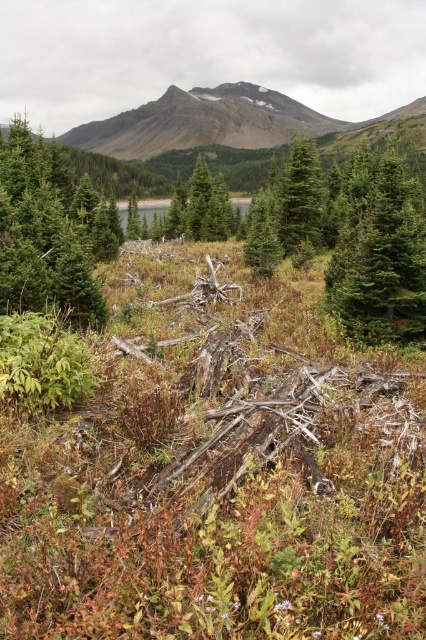
Looking at this image, you are navigating through a natural landscape and need to locate the green matte evergreen tree at upper left. Based on the coordinates provided, can you determine its position relative to the center of the image?

The green matte evergreen tree at upper left is located at point coordinates of 0.366 on the x axis and 0.101 on the y axis, which places it closer to the upper left corner of the image compared to the center.

You are a hiker trying to determine which tree is taller between the green matte evergreen tree at upper left and the green matte tree at center. Based on the scene, which one is taller?

The green matte tree at center is taller than the green matte evergreen tree at upper left.

You are an environmental scientist assessing the health of a forest. You observe two trees in the scene, the green matte evergreen tree at center and the green matte tree at center. Which tree has a smaller width?

The green matte evergreen tree at center has a lesser width compared to the green matte tree at center, so the green matte evergreen tree at center is smaller in width.